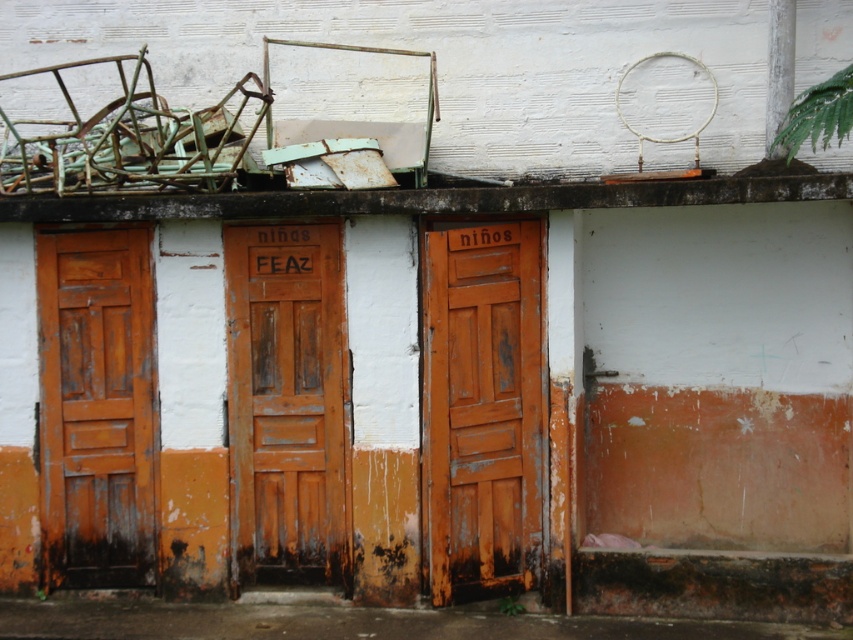
The image size is (853, 640). Describe the element at coordinates (286, 404) in the screenshot. I see `wooden door at center` at that location.

This screenshot has height=640, width=853. Find the location of `wooden door at center`. wooden door at center is located at coordinates (286, 404).

Does rusty wood door at center appear over rusty wood door at left?

Indeed, rusty wood door at center is positioned over rusty wood door at left.

Is rusty wood door at center positioned at the back of rusty wood door at left?

No.

Find the location of a particular element. The image size is (853, 640). rusty wood door at center is located at coordinates (482, 408).

Between rusty wood door at center and wooden door at center, which one has less height?

wooden door at center

Does rusty wood door at center come in front of wooden door at center?

That is True.

Who is more distant from viewer, (486,275) or (241,358)?

Point (241,358)

Find the location of a particular element. Image resolution: width=853 pixels, height=640 pixels. rusty wood door at center is located at coordinates (482, 408).